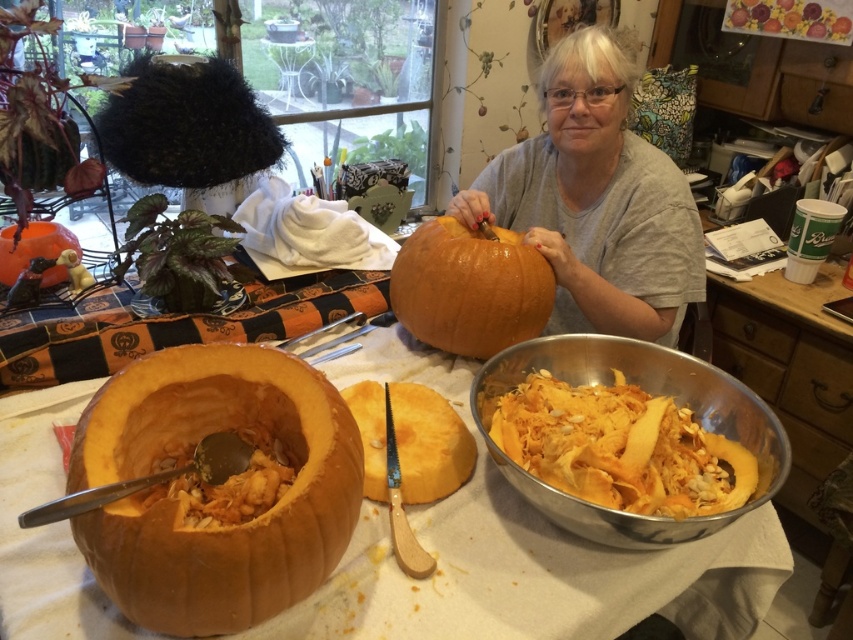
Based on the photo, is orange matte pumpkin at lower left to the right of orange fibrous pumpkin at lower center from the viewer's perspective?

No, orange matte pumpkin at lower left is not to the right of orange fibrous pumpkin at lower center.

Does orange matte pumpkin at lower left appear over orange fibrous pumpkin at lower center?

No.

Between point (219, 410) and point (500, 404), which one is positioned behind?

Positioned behind is point (500, 404).

The height and width of the screenshot is (640, 853). In order to click on orange matte pumpkin at lower left in this screenshot , I will do (x=184, y=506).

Who is positioned more to the right, gray matte shirt at upper center or spongy orange pumpkin at lower left?

Positioned to the right is gray matte shirt at upper center.

Is gray matte shirt at upper center bigger than spongy orange pumpkin at lower left?

Yes.

The image size is (853, 640). Describe the element at coordinates (596, 198) in the screenshot. I see `gray matte shirt at upper center` at that location.

Where is `gray matte shirt at upper center`? gray matte shirt at upper center is located at coordinates (596, 198).

At what (x,y) coordinates should I click in order to perform the action: click on orange pumpkin at center. Please return your answer as a coordinate pair (x, y). The height and width of the screenshot is (640, 853). Looking at the image, I should click on (521, 556).

Who is positioned more to the left, orange pumpkin at center or glossy orange pumpkin at center?

From the viewer's perspective, orange pumpkin at center appears more on the left side.

Is point (769, 544) closer to camera compared to point (457, 282)?

Yes, it is in front of point (457, 282).

The height and width of the screenshot is (640, 853). I want to click on orange pumpkin at center, so click(521, 556).